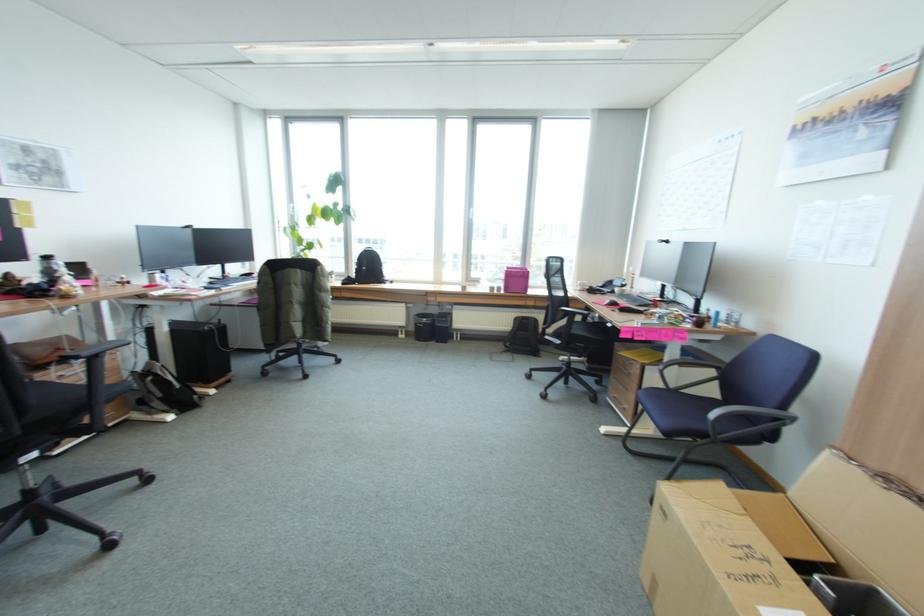
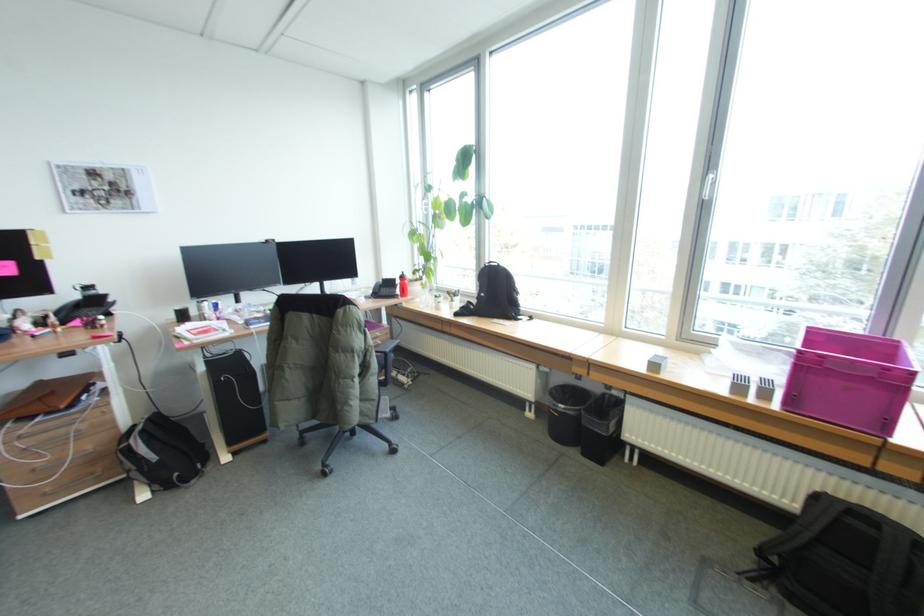
Where in the second image is the point corresponding to point (164, 375) from the first image?

(135, 444)